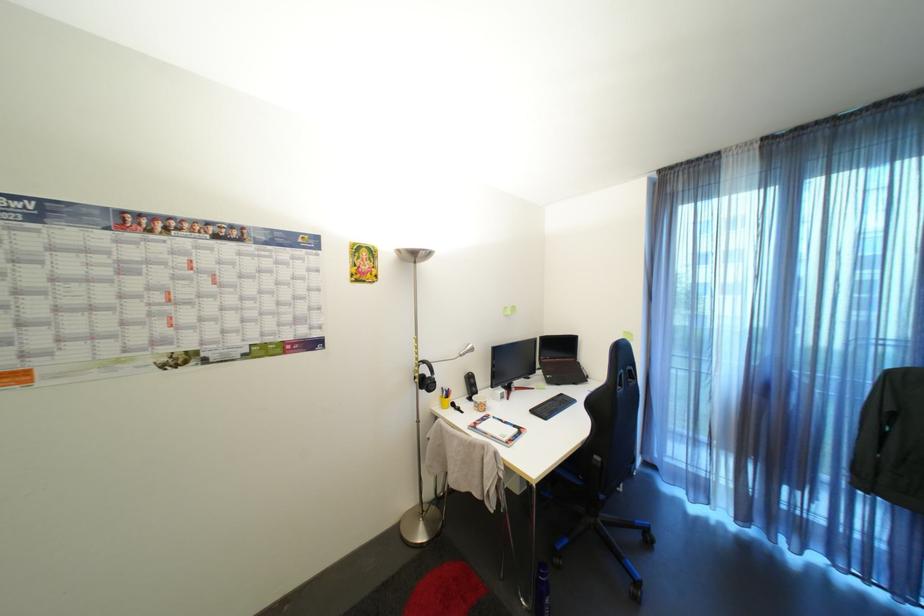
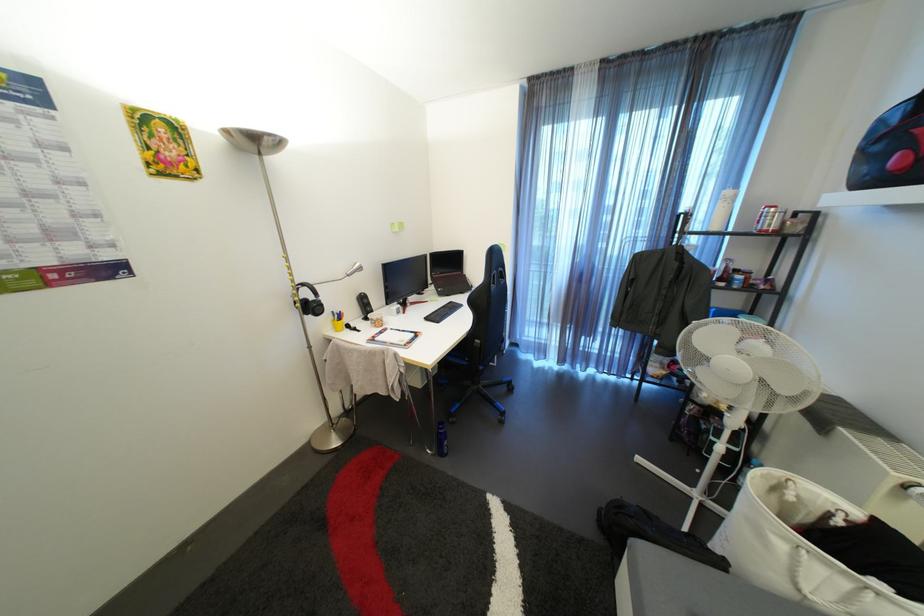
First-person continuous shooting, in which direction is the camera rotating?

The camera rotated toward right-down.